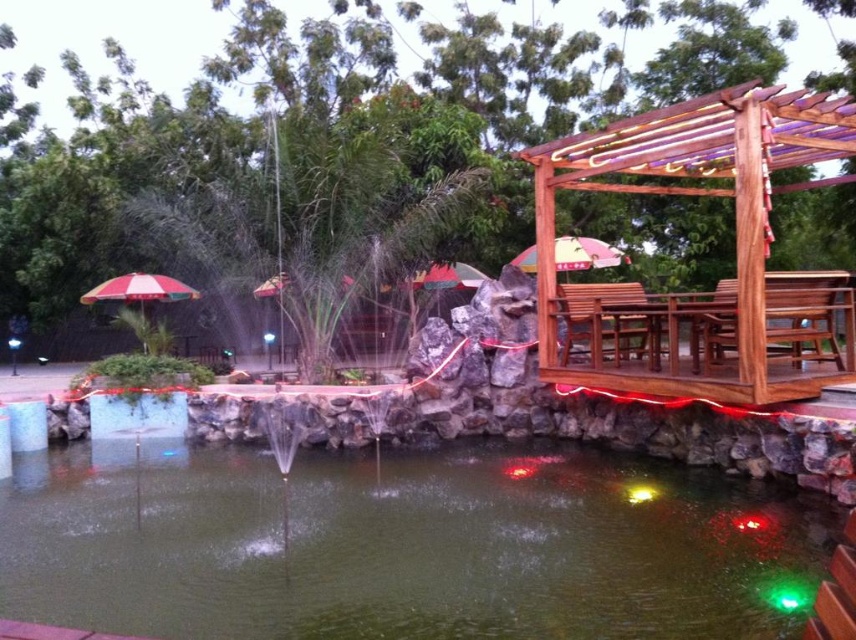
Looking at this image, you are standing at point (x=405, y=545) in the image. What is the immediate substance beneath your feet?

The immediate substance beneath your feet at point (x=405, y=545) is green liquid water at center.

You are standing at point (131, 285) and want to walk towards the wooden pergola with red string lights. Is the point (428, 516) in your path?

Yes, because point (428, 516) is in front of point (131, 285), so it lies along the path towards the wooden pergola with red string lights.